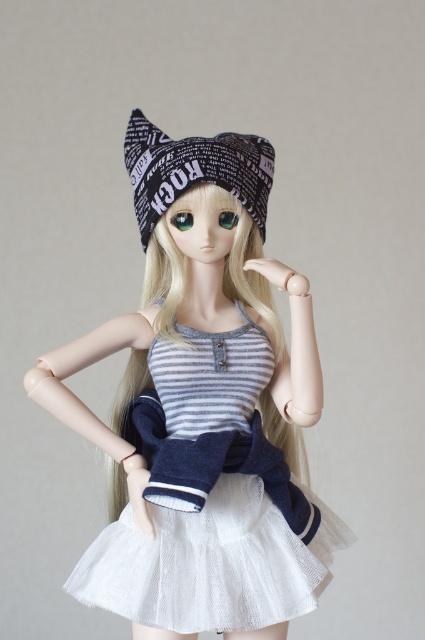
In the scene shown: Does white tulle skirt at center have a smaller size compared to black printed beanie at center?

No.

Locate an element on the screen. Image resolution: width=425 pixels, height=640 pixels. white tulle skirt at center is located at coordinates (204, 406).